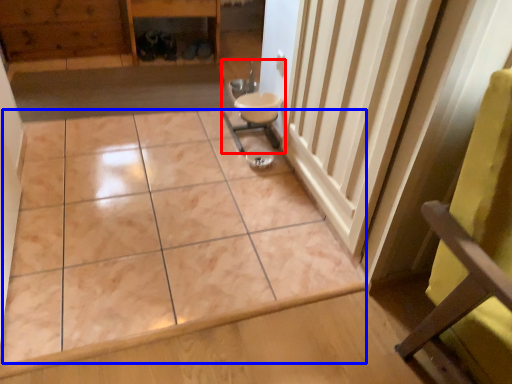
Question: Which point is further to the camera, sink (highlighted by a red box) or ceramic tile (highlighted by a blue box)?

Choices:
 (A) sink
 (B) ceramic tile

Answer: (A)